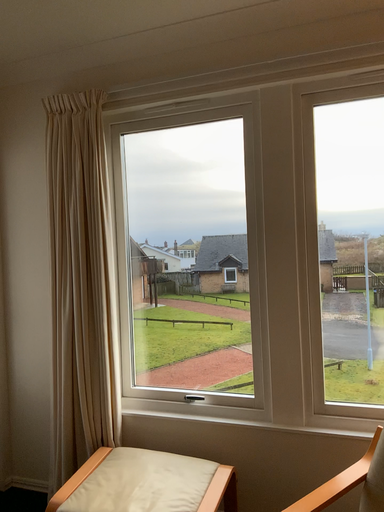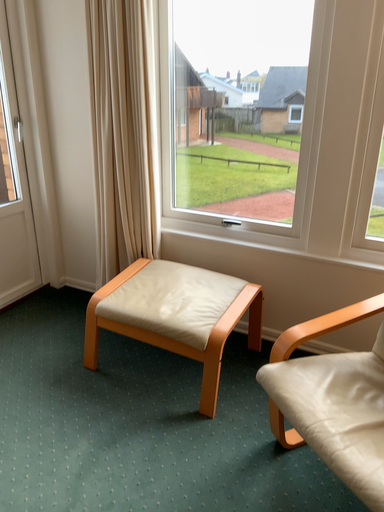
Question: Which way did the camera rotate in the video?

Choices:
 (A) rotated left
 (B) rotated right

Answer: (A)